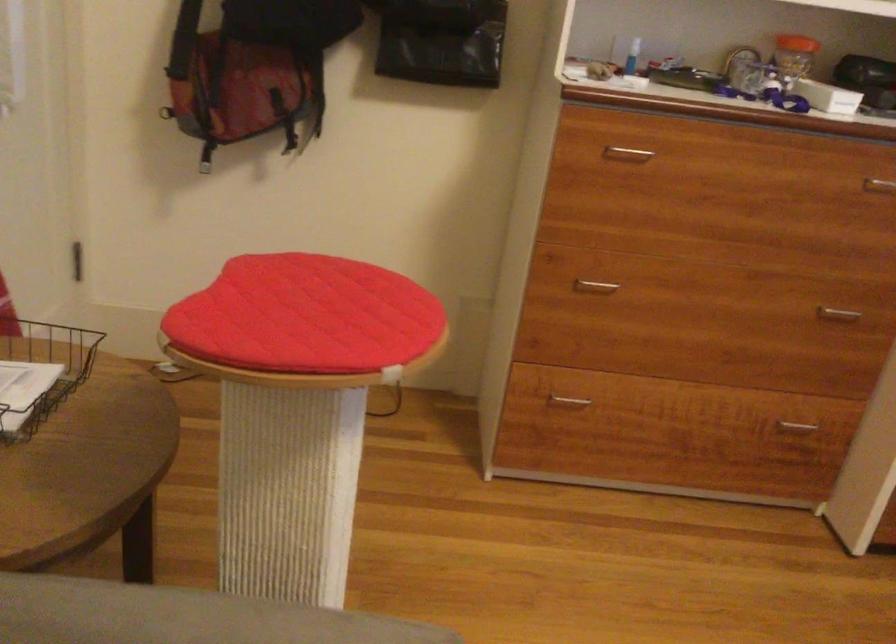
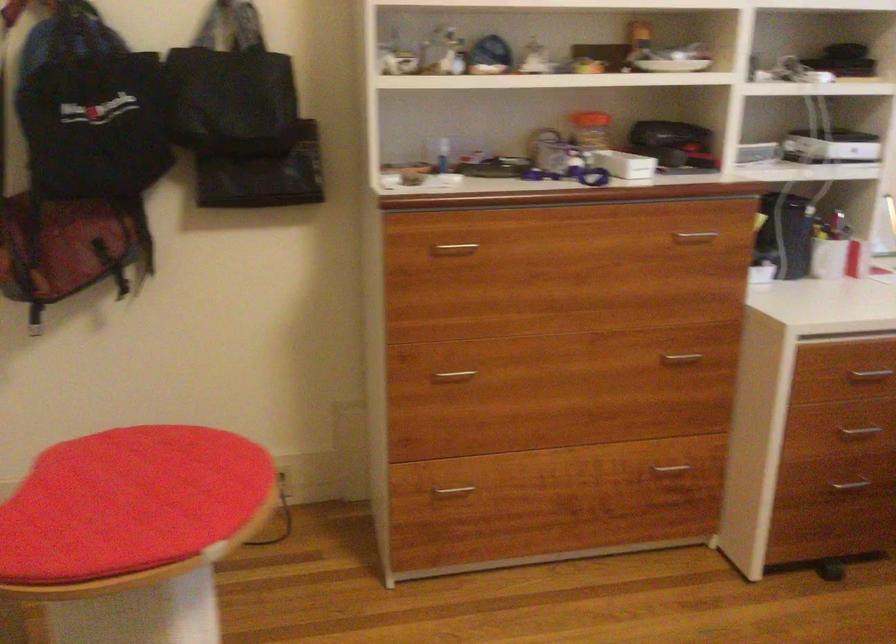
Question: The camera is either moving clockwise (left) or counter-clockwise (right) around the object. The first image is from the beginning of the video and the second image is from the end. Is the camera moving left or right when shooting the video?

Choices:
 (A) Left
 (B) Right

Answer: (A)